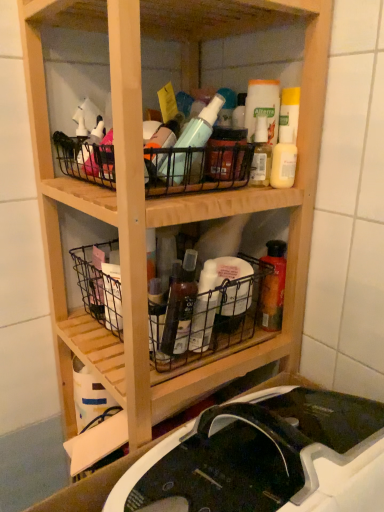
Question: Is black wire basket at upper center, the first basket from the top, at the left side of metallic wire basket at lower left, marked as the second basket in a top-to-bottom arrangement?

Choices:
 (A) yes
 (B) no

Answer: (B)

Question: Does black wire basket at upper center, acting as the third basket starting from the bottom, have a greater width compared to metallic wire basket at lower left, placed as the 2th basket when sorted from bottom to top?

Choices:
 (A) no
 (B) yes

Answer: (B)

Question: From the image's perspective, is black wire basket at upper center, acting as the third basket starting from the bottom, on metallic wire basket at lower left, placed as the 2th basket when sorted from bottom to top?

Choices:
 (A) yes
 (B) no

Answer: (A)

Question: Is black wire basket at upper center, the first basket from the top, further to camera compared to metallic wire basket at lower left, marked as the second basket in a top-to-bottom arrangement?

Choices:
 (A) yes
 (B) no

Answer: (B)

Question: From the image's perspective, is black wire basket at upper center, acting as the third basket starting from the bottom, located beneath metallic wire basket at lower left, placed as the 2th basket when sorted from bottom to top?

Choices:
 (A) no
 (B) yes

Answer: (A)

Question: From a real-world perspective, is translucent plastic bottle at center, which appears as the 2th bottle when viewed from the right, above or below black wire basket at upper center, acting as the third basket starting from the bottom?

Choices:
 (A) below
 (B) above

Answer: (A)

Question: Is translucent plastic bottle at center, which is the 1th bottle from left to right, wider or thinner than black wire basket at upper center, the first basket from the top?

Choices:
 (A) thin
 (B) wide

Answer: (A)

Question: From the image's perspective, relative to black wire basket at upper center, the first basket from the top, is translucent plastic bottle at center, which is the 1th bottle from left to right, above or below?

Choices:
 (A) below
 (B) above

Answer: (A)

Question: From their relative heights in the image, would you say translucent plastic bottle at center, which is the 1th bottle from left to right, is taller or shorter than black wire basket at upper center, acting as the third basket starting from the bottom?

Choices:
 (A) tall
 (B) short

Answer: (A)

Question: Considering the positions of matte white bottle at upper right and translucent plastic bottle at center, the 1th bottle from the top, in the image, is matte white bottle at upper right bigger or smaller than translucent plastic bottle at center, the 1th bottle from the top,?

Choices:
 (A) small
 (B) big

Answer: (B)

Question: Considering the positions of matte white bottle at upper right and translucent plastic bottle at center, which appears as the 2th bottle when viewed from the left, in the image, is matte white bottle at upper right wider or thinner than translucent plastic bottle at center, which appears as the 2th bottle when viewed from the left,?

Choices:
 (A) thin
 (B) wide

Answer: (B)

Question: From a real-world perspective, is matte white bottle at upper right above or below translucent plastic bottle at center, acting as the second bottle starting from the bottom?

Choices:
 (A) below
 (B) above

Answer: (B)

Question: From their relative heights in the image, would you say matte white bottle at upper right is taller or shorter than translucent plastic bottle at center, acting as the second bottle starting from the bottom?

Choices:
 (A) tall
 (B) short

Answer: (A)

Question: Considering the relative positions of metallic wire basket at lower left, placed as the 2th basket when sorted from bottom to top, and translucent plastic bottle at center, acting as the second bottle starting from the bottom, in the image provided, is metallic wire basket at lower left, placed as the 2th basket when sorted from bottom to top, to the left or to the right of translucent plastic bottle at center, acting as the second bottle starting from the bottom,?

Choices:
 (A) right
 (B) left

Answer: (B)

Question: Is metallic wire basket at lower left, marked as the second basket in a top-to-bottom arrangement, wider or thinner than translucent plastic bottle at center, which appears as the 2th bottle when viewed from the left?

Choices:
 (A) thin
 (B) wide

Answer: (B)